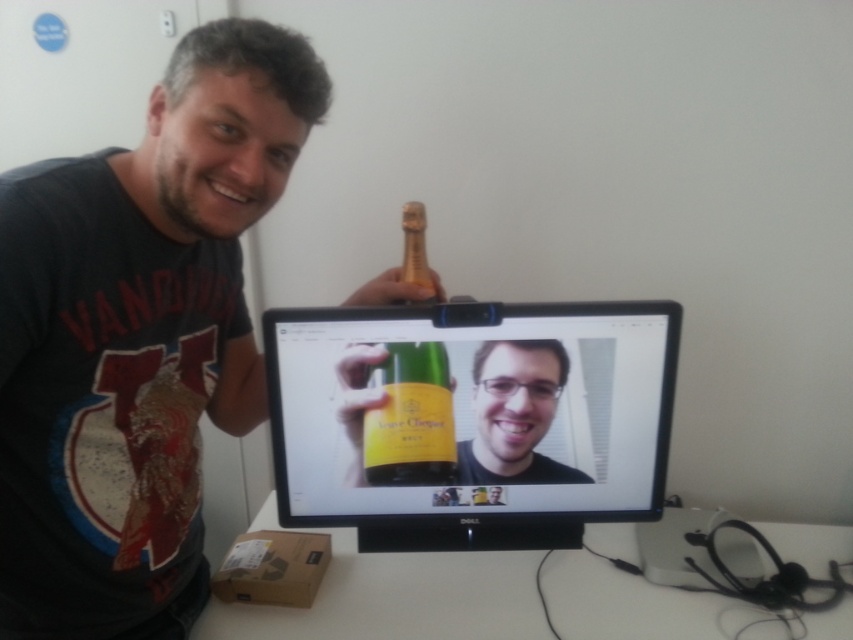
Can you confirm if white matte table at lower center is shorter than green glass bottle at center?

Yes, white matte table at lower center is shorter than green glass bottle at center.

This screenshot has height=640, width=853. Find the location of `white matte table at lower center`. white matte table at lower center is located at coordinates (398, 598).

Which is behind, point (218, 244) or point (428, 273)?

The point (428, 273) is behind.

Identify the location of matte black t-shirt at left. This screenshot has height=640, width=853. (137, 337).

At what (x,y) coordinates should I click in order to perform the action: click on matte black t-shirt at left. Please return your answer as a coordinate pair (x, y). The image size is (853, 640). Looking at the image, I should click on (137, 337).

Who is shorter, matte black t-shirt at left or white matte table at lower center?

white matte table at lower center

The width and height of the screenshot is (853, 640). Describe the element at coordinates (137, 337) in the screenshot. I see `matte black t-shirt at left` at that location.

Identify the location of matte black t-shirt at left. (137, 337).